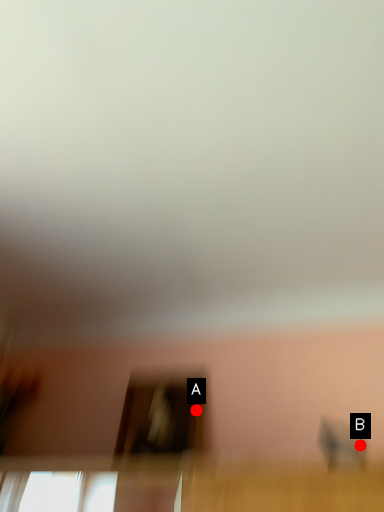
Question: Two points are circled on the image, labeled by A and B beside each circle. Which point is farther to the camera?

Choices:
 (A) A is further
 (B) B is further

Answer: (A)